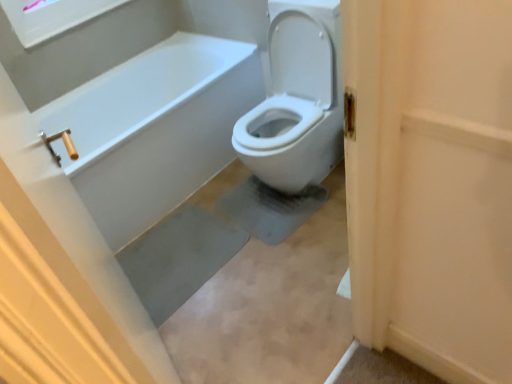
Where is `white glossy toilet at center`? Image resolution: width=512 pixels, height=384 pixels. white glossy toilet at center is located at coordinates (297, 99).

What do you see at coordinates (297, 99) in the screenshot?
I see `white glossy toilet at center` at bounding box center [297, 99].

What do you see at coordinates (446, 188) in the screenshot? Image resolution: width=512 pixels, height=384 pixels. I see `white matte screen door at upper right` at bounding box center [446, 188].

Locate an element on the screen. This screenshot has height=384, width=512. white matte screen door at upper right is located at coordinates (446, 188).

Identify the location of white glossy toilet at center. This screenshot has height=384, width=512. point(297,99).

Which object is positioned more to the left, white glossy toilet at center or white matte screen door at upper right?

white glossy toilet at center.

Considering the relative positions of white glossy toilet at center and white matte screen door at upper right in the image provided, is white glossy toilet at center in front of white matte screen door at upper right?

No, white glossy toilet at center is behind white matte screen door at upper right.

Is point (326, 91) less distant than point (379, 244)?

No, it is behind (379, 244).

From the image's perspective, is white glossy toilet at center under white matte screen door at upper right?

Incorrect, from the image's perspective, white glossy toilet at center is higher than white matte screen door at upper right.

From a real-world perspective, who is located higher, white glossy toilet at center or white matte screen door at upper right?

white matte screen door at upper right, from a real-world perspective.

Is white glossy toilet at center wider than white matte screen door at upper right?

Indeed, white glossy toilet at center has a greater width compared to white matte screen door at upper right.

Does white glossy toilet at center have a lesser height compared to white matte screen door at upper right?

No.

Does white glossy toilet at center have a larger size compared to white matte screen door at upper right?

Yes.

Is white glossy toilet at center positioned beyond the bounds of white matte screen door at upper right?

Indeed, white glossy toilet at center is completely outside white matte screen door at upper right.

Is white glossy toilet at center beside white matte screen door at upper right?

No, white glossy toilet at center is not in contact with white matte screen door at upper right.

Is white glossy toilet at center turned away from white matte screen door at upper right?

white glossy toilet at center is not turned away from white matte screen door at upper right.

What's the angular difference between white glossy toilet at center and white matte screen door at upper right's facing directions?

The angle between the facing direction of white glossy toilet at center and the facing direction of white matte screen door at upper right is 179 degrees.

Image resolution: width=512 pixels, height=384 pixels. I want to click on toilet below the white matte screen door at upper right (from a real-world perspective), so click(x=297, y=99).

Visually, is white matte screen door at upper right positioned to the left or to the right of white glossy toilet at center?

From the image, it's evident that white matte screen door at upper right is to the right of white glossy toilet at center.

Is white matte screen door at upper right closer to the viewer compared to white glossy toilet at center?

Yes, white matte screen door at upper right is in front of white glossy toilet at center.

Does point (470, 268) come in front of point (302, 60)?

That is True.

From the image's perspective, relative to white glossy toilet at center, is white matte screen door at upper right above or below?

From the image's perspective, white matte screen door at upper right appears below white glossy toilet at center.

From the picture: From a real-world perspective, is white matte screen door at upper right on white glossy toilet at center?

Yes, from a real-world perspective, white matte screen door at upper right is above white glossy toilet at center.

Consider the image. Can you confirm if white matte screen door at upper right is wider than white glossy toilet at center?

Incorrect, the width of white matte screen door at upper right does not surpass that of white glossy toilet at center.

Between white matte screen door at upper right and white glossy toilet at center, which one has less height?

white matte screen door at upper right is shorter.

Which of these two, white matte screen door at upper right or white glossy toilet at center, is smaller?

white matte screen door at upper right is smaller.

Would you say white matte screen door at upper right contains white glossy toilet at center?

Actually, white glossy toilet at center is outside white matte screen door at upper right.

Would you consider white matte screen door at upper right to be distant from white glossy toilet at center?

Yes, white matte screen door at upper right is far from white glossy toilet at center.

Is white matte screen door at upper right oriented away from white glossy toilet at center?

No.

How many degrees apart are the facing directions of white matte screen door at upper right and white glossy toilet at center?

There is a 179-degree angle between the facing directions of white matte screen door at upper right and white glossy toilet at center.

This screenshot has height=384, width=512. Find the location of `screen door that is below the white glossy toilet at center (from the image's perspective)`. screen door that is below the white glossy toilet at center (from the image's perspective) is located at coordinates (446, 188).

This screenshot has width=512, height=384. I want to click on toilet lying above the white matte screen door at upper right (from the image's perspective), so click(x=297, y=99).

At what (x,y) coordinates should I click in order to perform the action: click on screen door above the white glossy toilet at center (from a real-world perspective). Please return your answer as a coordinate pair (x, y). The width and height of the screenshot is (512, 384). Looking at the image, I should click on (446, 188).